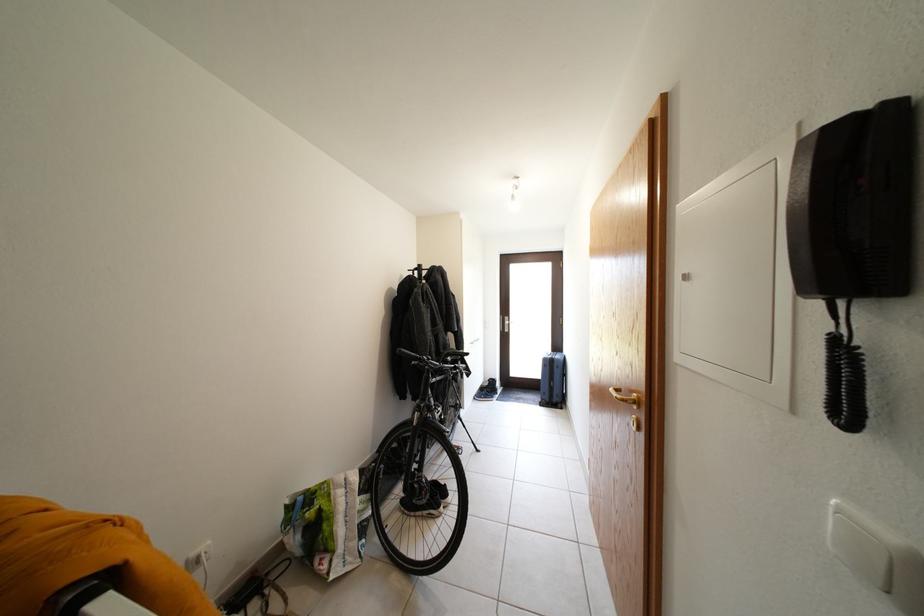
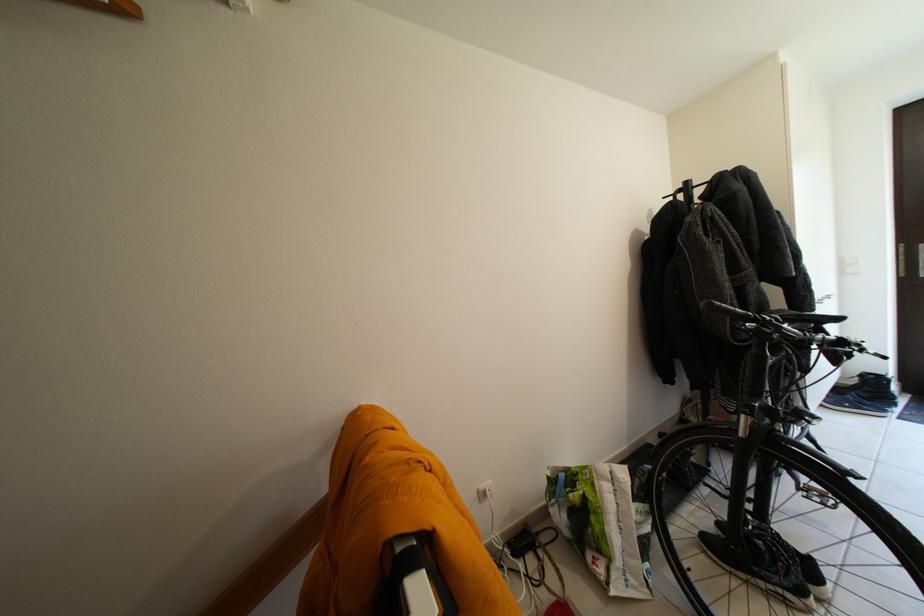
In the second image, find the point that corresponds to point (432, 507) in the first image.

(794, 588)